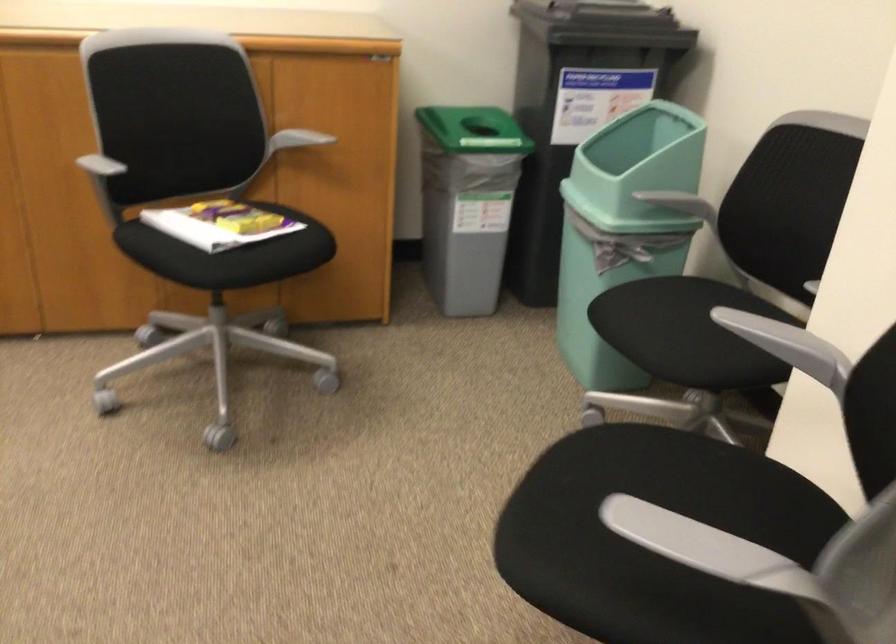
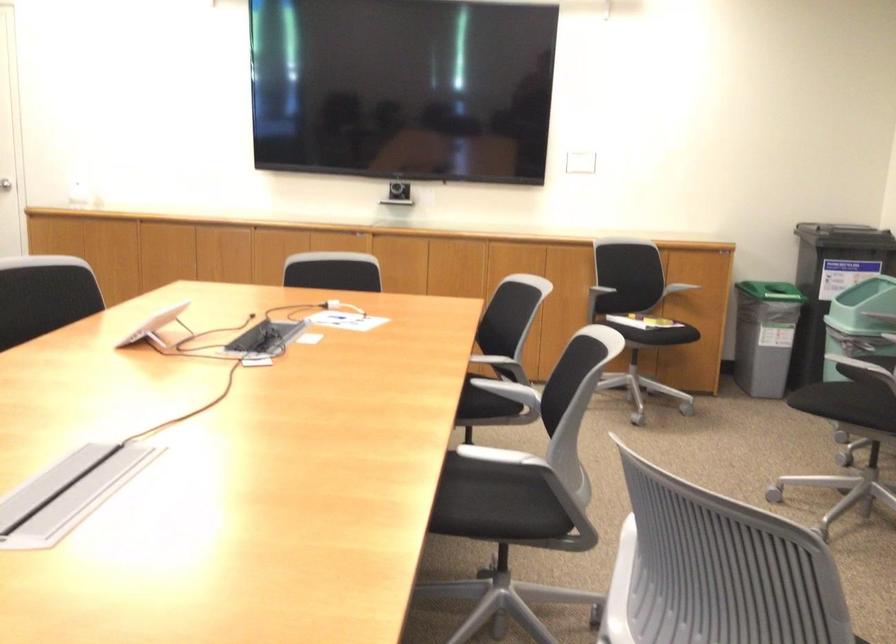
Where in the second image is the point corresponding to point 212,247 from the first image?

(636, 313)